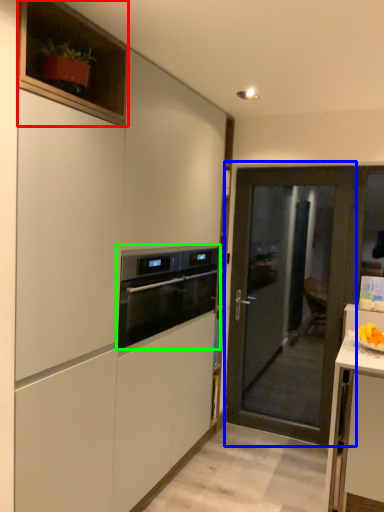
Question: Estimate the real-world distances between objects in this image. Which object is closer to cabinetry (highlighted by a red box), door (highlighted by a blue box) or kitchen appliance (highlighted by a green box)?

Choices:
 (A) door
 (B) kitchen appliance

Answer: (B)